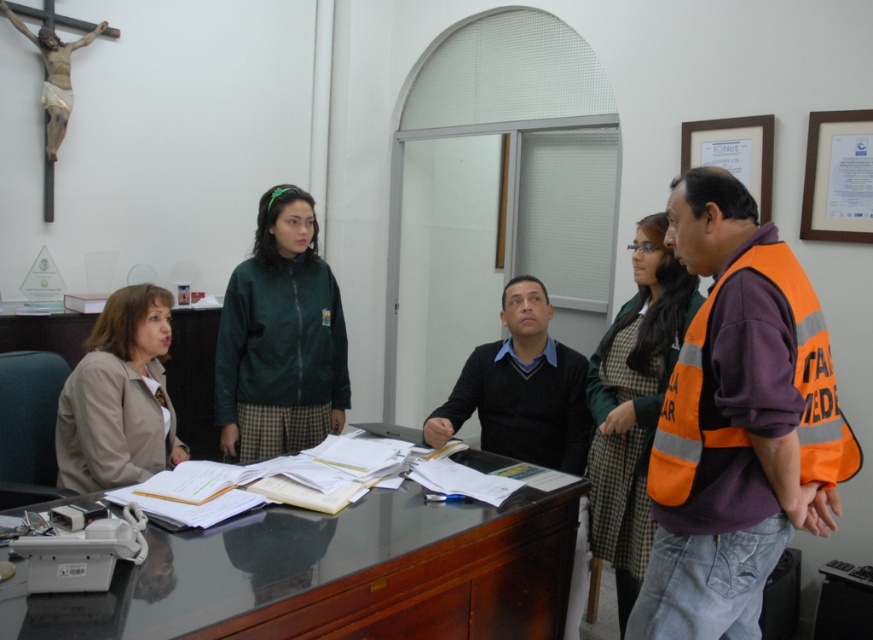
You are an office worker who needs to locate the orange reflective vest at right and the green matte jacket at center. Based on the scene description, which object is positioned lower in the image?

The orange reflective vest at right is positioned below the green matte jacket at center, so the orange reflective vest at right is lower in the image.

You are an office worker who needs to reach the green matte jacket at center quickly. There is an orange reflective vest at right in your path. Can you walk straight ahead without stepping around it?

The orange reflective vest at right is closer to the viewer than the green matte jacket at center, so you would encounter the orange reflective vest at right first. You would need to step around it to reach the green matte jacket at center.

You are standing at point (78, 481) and want to walk to point (263, 225). Is the destination point behind you?

Yes, point (263, 225) is behind point (78, 481), so the destination point is behind you.